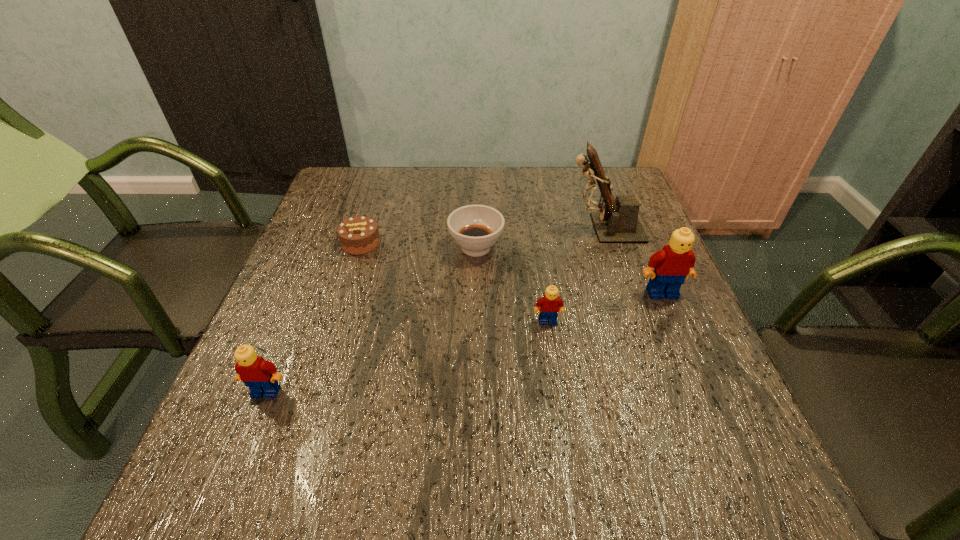
Find the location of a particular element. This screenshot has height=540, width=960. vacant region located on the front-facing side of the third shortest object is located at coordinates (558, 388).

The width and height of the screenshot is (960, 540). I want to click on free space located 0.090m on the front-facing side of the tallest Lego, so click(x=678, y=331).

Identify the location of vacant space located 0.260m on the front-facing side of the figurine. The image size is (960, 540). (467, 228).

The height and width of the screenshot is (540, 960). In order to click on free space located 0.160m on the front-facing side of the figurine in this screenshot , I will do `click(504, 228)`.

Find the location of a particular element. This screenshot has height=540, width=960. blank space located 0.260m on the front-facing side of the figurine is located at coordinates (467, 228).

You are a GUI agent. You are given a task and a screenshot of the screen. Output one action in this format:
    pyautogui.click(x=<x>, y=<y>)
    Task: Click on the free region located on the right of the chocolate cake
    
    Given the screenshot: What is the action you would take?
    pyautogui.click(x=534, y=243)

Find the location of `free region located on the right of the fourth object from right to left`. free region located on the right of the fourth object from right to left is located at coordinates (551, 247).

Locate an element on the screen. Image resolution: width=960 pixels, height=540 pixels. object that is positioned at the near edge is located at coordinates (261, 376).

The image size is (960, 540). Identify the location of Lego present at the left edge. (261, 376).

Where is `chocolate cake that is at the left edge`? chocolate cake that is at the left edge is located at coordinates (358, 235).